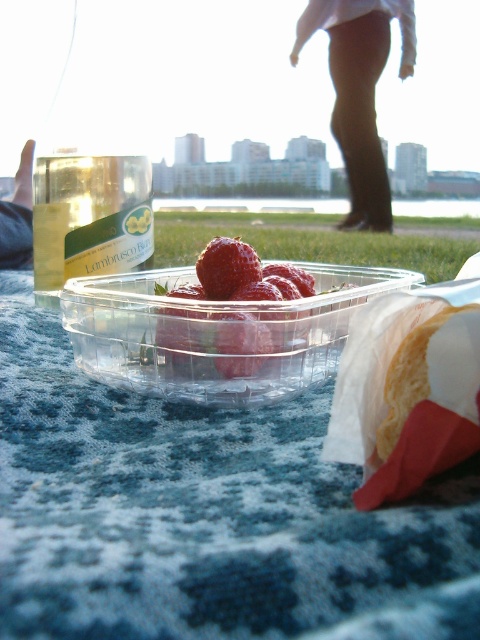
You are a photographer trying to capture the shiny red strawberries at center and the black fabric pants at upper center in the same frame. Which object should you focus on first to ensure both are in focus, considering their sizes?

The black fabric pants at upper center is larger in size than the shiny red strawberries at center, so focusing on the larger object first would help ensure both are in focus.

You are a photographer trying to capture the shiny red strawberries at center without including the black fabric pants at upper center in the frame. Based on their positions, is this possible?

The black fabric pants at upper center is located above the shiny red strawberries at center, so it is possible to capture the strawberries without the pants by adjusting the camera angle to exclude the upper part of the frame.